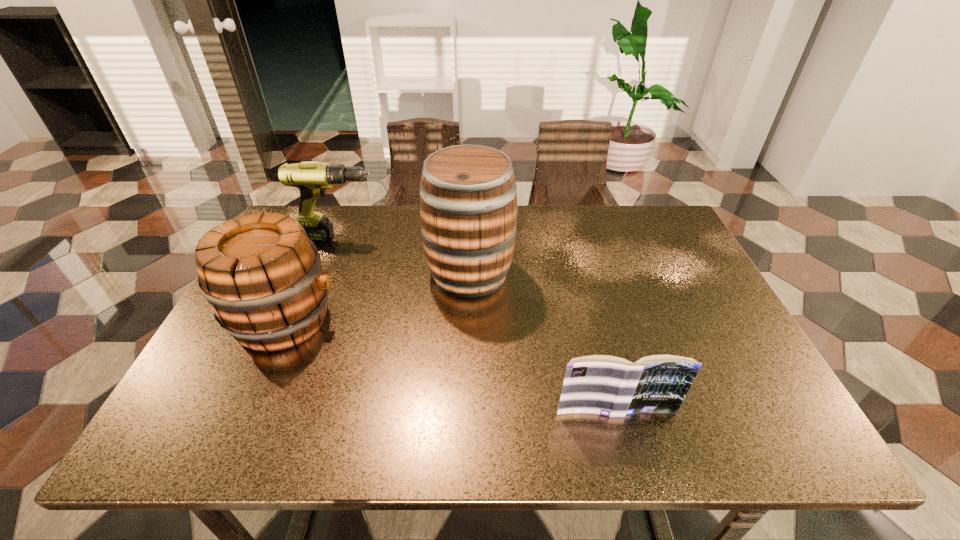
At what (x,y) coordinates should I click in order to perform the action: click on unoccupied position between the book and the left cider. Please return your answer as a coordinate pair (x, y). Looking at the image, I should click on (450, 366).

Locate an element on the screen. empty location between the farthest object and the rightmost object is located at coordinates (478, 325).

At what (x,y) coordinates should I click in order to perform the action: click on vacant area that lies between the shorter cider and the taller cider. Please return your answer as a coordinate pair (x, y). Looking at the image, I should click on (377, 295).

Locate an element on the screen. This screenshot has width=960, height=540. free area in between the book and the drill is located at coordinates (478, 325).

Identify the location of unoccupied position between the shorter cider and the second object from right to left. (377, 295).

Find the location of a particular element. This screenshot has height=540, width=960. free area in between the right cider and the shortest object is located at coordinates (542, 342).

The height and width of the screenshot is (540, 960). What are the coordinates of `free space between the farthest object and the rightmost object` in the screenshot? It's located at (478, 325).

Find the location of a particular element. The image size is (960, 540). vacant area that lies between the rightmost object and the drill is located at coordinates (478, 325).

Locate which object ranks second in proximity to the left cider. Please provide its 2D coordinates. Your answer should be formatted as a tuple, i.e. [(x, y)], where the tuple contains the x and y coordinates of a point satisfying the conditions above.

[(468, 194)]

This screenshot has height=540, width=960. I want to click on the second closest object to the drill, so click(262, 276).